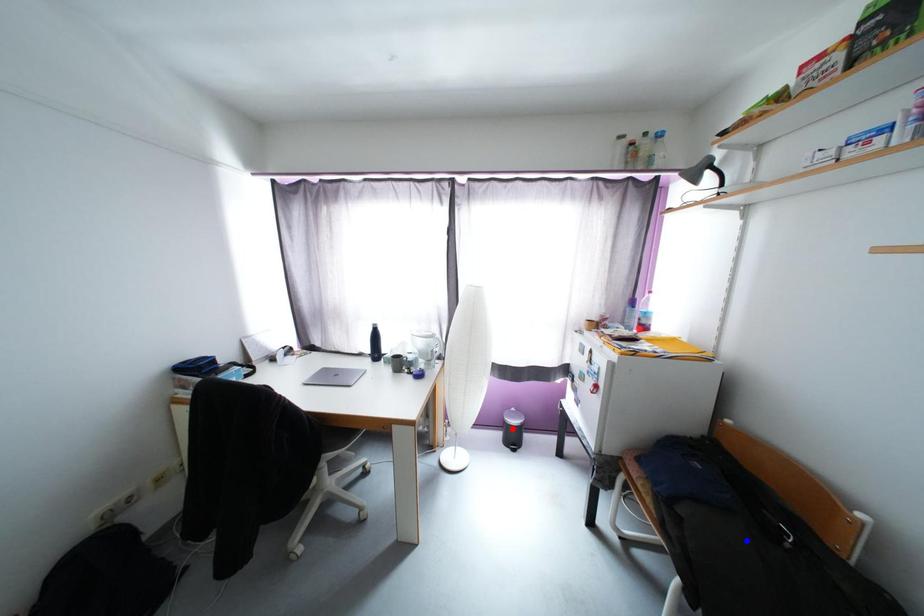
Question: Two points are marked on the image. Which point is closer to the camera?

Choices:
 (A) Blue point is closer.
 (B) Red point is closer.

Answer: (A)